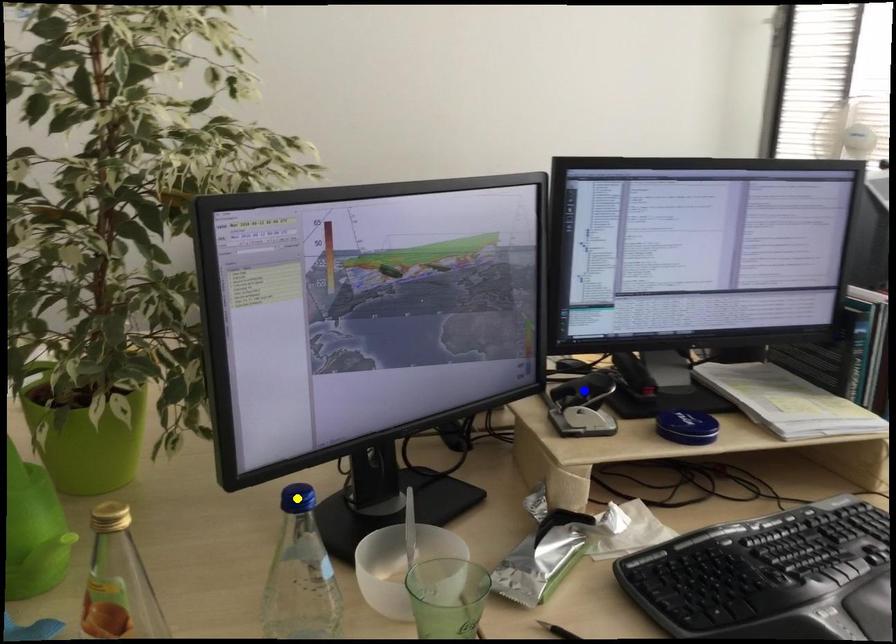
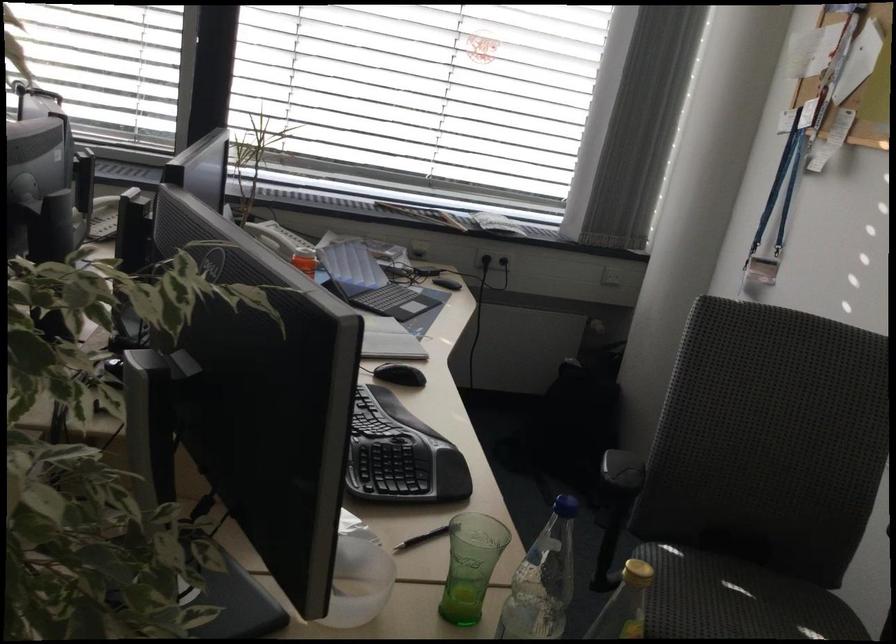
I am providing you with two images of the same scene from different viewpoints. Three points are marked in image1. Which point corresponds to a part or object that is occluded in image2?In image1, three points are marked. Which of them correspond to a part or object that is occluded in image2?Among the three points shown in image1, which one corresponds to a part or object that is no longer visible due to occlusion in image2?

green point, yellow point, blue point cannot be seen in image2.